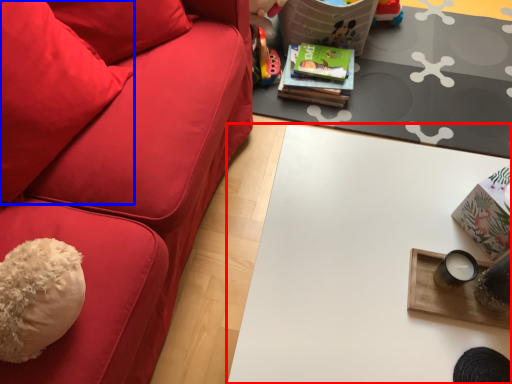
Question: Among these objects, which one is farthest to the camera, table (highlighted by a red box) or throw pillow (highlighted by a blue box)?

Choices:
 (A) table
 (B) throw pillow

Answer: (A)